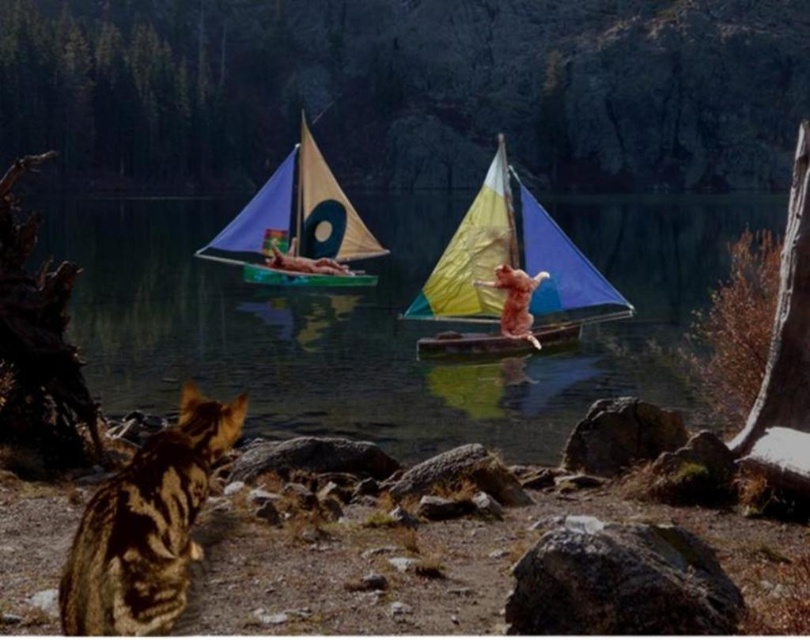
Who is shorter, tabby fur cat at lower left or matte yellow sailboat at center?

→ tabby fur cat at lower left

Can you confirm if tabby fur cat at lower left is smaller than matte yellow sailboat at center?

Yes, tabby fur cat at lower left is smaller than matte yellow sailboat at center.

Is point (77, 632) positioned behind point (248, 209)?

No, (77, 632) is in front of (248, 209).

Find the location of a particular element. tabby fur cat at lower left is located at coordinates (146, 525).

Who is positioned more to the left, matte yellow sailboat at center or wooden canoe at center?

From the viewer's perspective, matte yellow sailboat at center appears more on the left side.

Can you confirm if matte yellow sailboat at center is smaller than wooden canoe at center?

Incorrect, matte yellow sailboat at center is not smaller in size than wooden canoe at center.

Is point (227, 262) closer to viewer compared to point (448, 339)?

No, (227, 262) is behind (448, 339).

Where is `matte yellow sailboat at center`? Image resolution: width=810 pixels, height=640 pixels. matte yellow sailboat at center is located at coordinates (297, 227).

Does transparent plastic water at center appear on the left side of tabby fur cat at lower left?

In fact, transparent plastic water at center is to the right of tabby fur cat at lower left.

I want to click on transparent plastic water at center, so click(x=373, y=320).